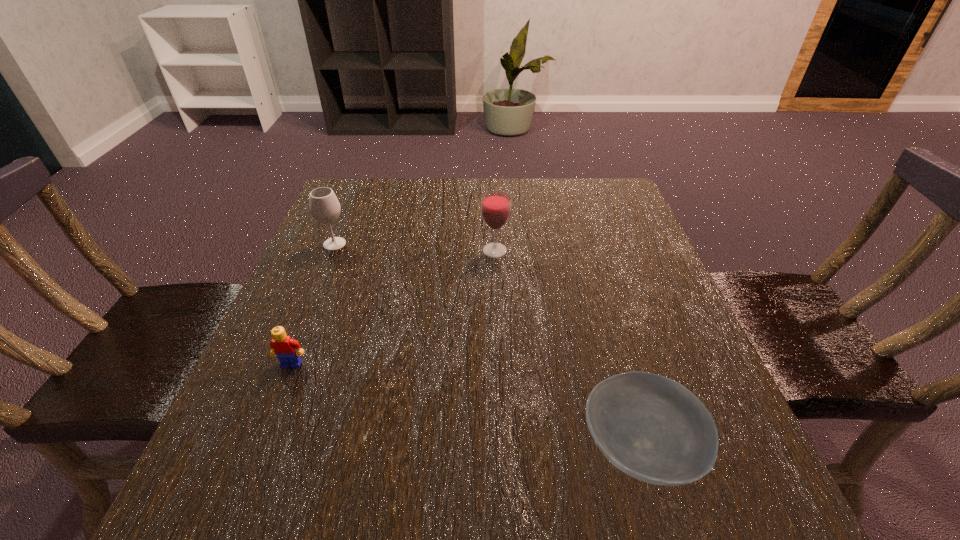
This screenshot has height=540, width=960. Identify the location of wineglass that is positioned at the left edge. (324, 206).

Image resolution: width=960 pixels, height=540 pixels. I want to click on Lego located at the left edge, so tap(283, 346).

Identify the location of object that is at the right edge. (652, 428).

Find the location of a particular element. The width and height of the screenshot is (960, 540). object at the near right corner is located at coordinates (652, 428).

The height and width of the screenshot is (540, 960). Identify the location of vacant position at the far edge of the desktop. (411, 226).

In the image, there is a desktop. Where is `free space at the near edge`? free space at the near edge is located at coordinates (609, 476).

Image resolution: width=960 pixels, height=540 pixels. I want to click on blank space at the left edge of the desktop, so click(x=315, y=415).

Locate an element on the screen. vacant space at the right edge of the desktop is located at coordinates (682, 364).

At what (x,y) coordinates should I click in order to perform the action: click on vacant space at the far left corner. Please return your answer as a coordinate pair (x, y). This screenshot has height=540, width=960. Looking at the image, I should click on (373, 186).

Locate an element on the screen. Image resolution: width=960 pixels, height=540 pixels. vacant space at the near left corner is located at coordinates (305, 491).